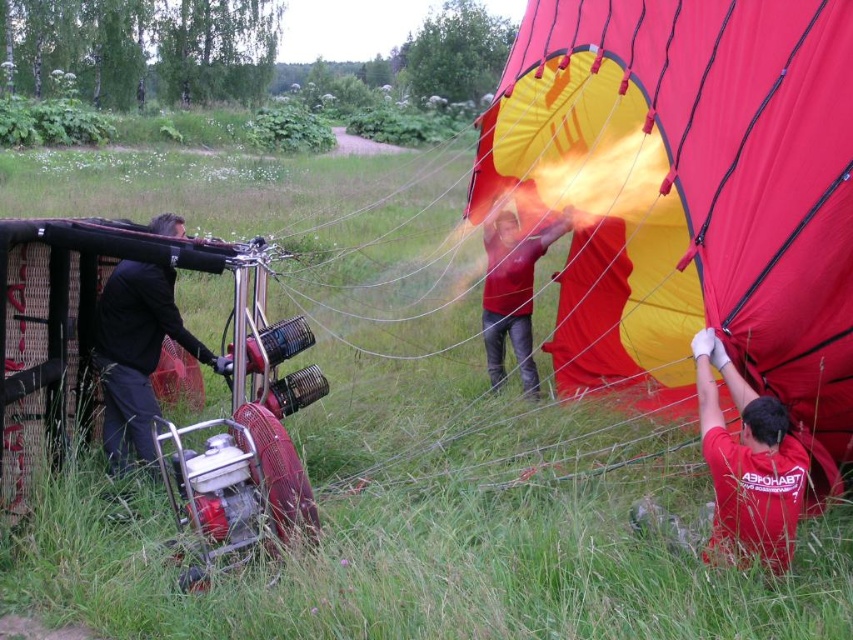
Is point (125, 381) positioned after point (485, 282)?

No, it is not.

Can you confirm if black matte jacket at left is bigger than red matte shirt at center?

Yes, black matte jacket at left is bigger than red matte shirt at center.

Between point (218, 364) and point (512, 224), which one is positioned behind?

Point (512, 224)

Locate an element on the screen. This screenshot has width=853, height=640. black matte jacket at left is located at coordinates (137, 355).

Locate an element on the screen. matte red parachute at center is located at coordinates (697, 196).

Who is lower down, matte red parachute at center or black matte jacket at left?

black matte jacket at left is below.

Does point (560, 134) come behind point (126, 262)?

Yes, point (560, 134) is farther from viewer.

Image resolution: width=853 pixels, height=640 pixels. What are the coordinates of `matte red parachute at center` in the screenshot? It's located at (697, 196).

Is red matte shirt at lower right to the right of red matte shirt at center from the viewer's perspective?

Correct, you'll find red matte shirt at lower right to the right of red matte shirt at center.

Which is more to the left, red matte shirt at lower right or red matte shirt at center?

Positioned to the left is red matte shirt at center.

Which is in front, point (744, 497) or point (525, 257)?

Point (744, 497) is in front.

At what (x,y) coordinates should I click in order to perform the action: click on red matte shirt at lower right. Please return your answer as a coordinate pair (x, y). The width and height of the screenshot is (853, 640). Looking at the image, I should click on (747, 464).